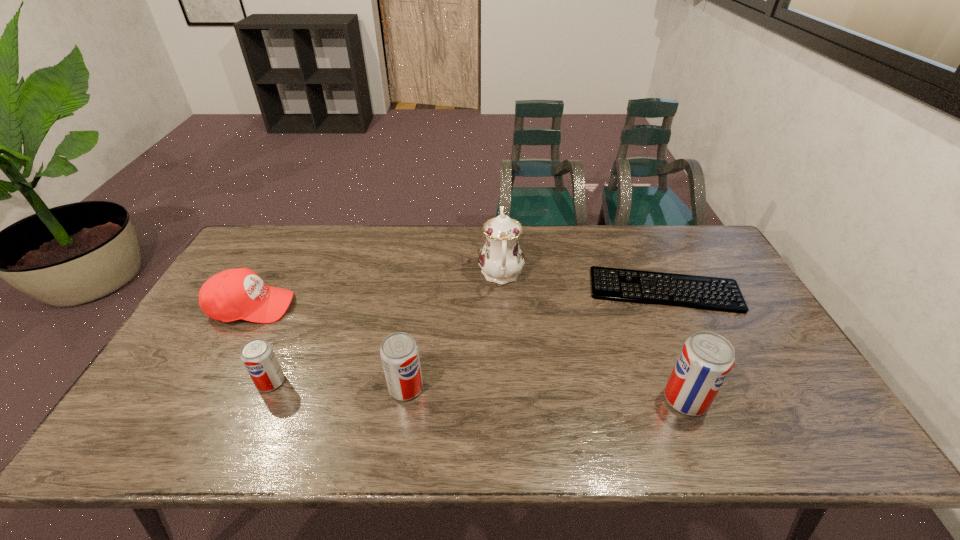
Please mark a free spot for a new pop_(soda) to balance the arrangement. Please provide its 2D coordinates. Your answer should be formatted as a tuple, i.e. [(x, y)], where the tuple contains the x and y coordinates of a point satisfying the conditions above.

[(544, 393)]